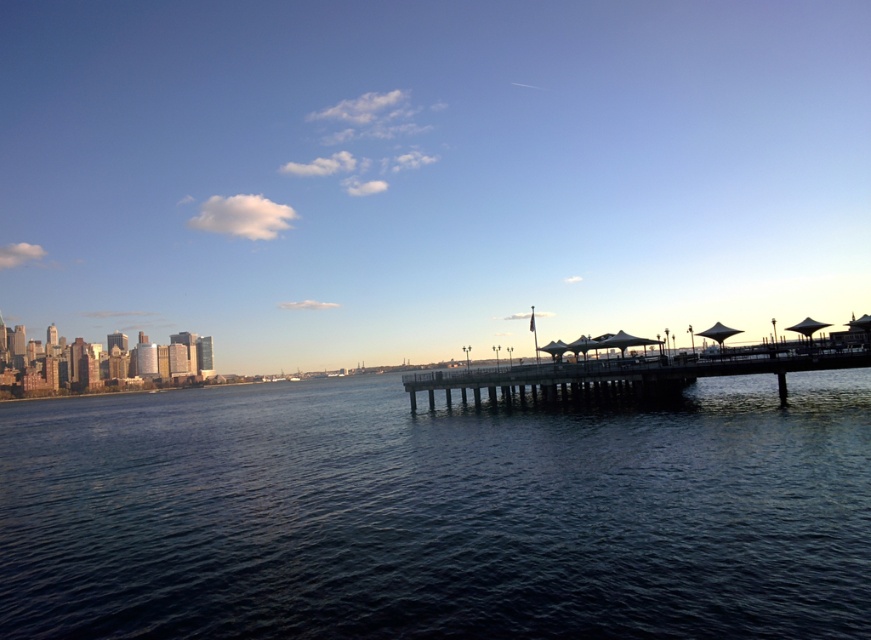
Could you measure the distance between transparent fabric umbrella at center-right and transparent plastic umbrella at center?

A distance of 6.40 meters exists between transparent fabric umbrella at center-right and transparent plastic umbrella at center.

The image size is (871, 640). What do you see at coordinates (718, 332) in the screenshot?
I see `transparent fabric umbrella at center-right` at bounding box center [718, 332].

In the scene shown: Measure the distance between point [712,324] and camera.

Point [712,324] and camera are 123.21 feet apart.

Where is `transparent fabric umbrella at center-right`? transparent fabric umbrella at center-right is located at coordinates (718, 332).

Does white matte umbrella at center have a lesser width compared to transparent fabric umbrella at center-right?

No.

Which is more to the right, white matte umbrella at center or transparent fabric umbrella at center-right?

transparent fabric umbrella at center-right

Where is `white matte umbrella at center`? white matte umbrella at center is located at coordinates (625, 340).

Between point (718, 344) and point (539, 348), which one is positioned in front?

Point (718, 344)

Image resolution: width=871 pixels, height=640 pixels. What do you see at coordinates (718, 332) in the screenshot? I see `transparent fabric umbrella at center-right` at bounding box center [718, 332].

The image size is (871, 640). Identify the location of transparent fabric umbrella at center-right. pyautogui.click(x=718, y=332).